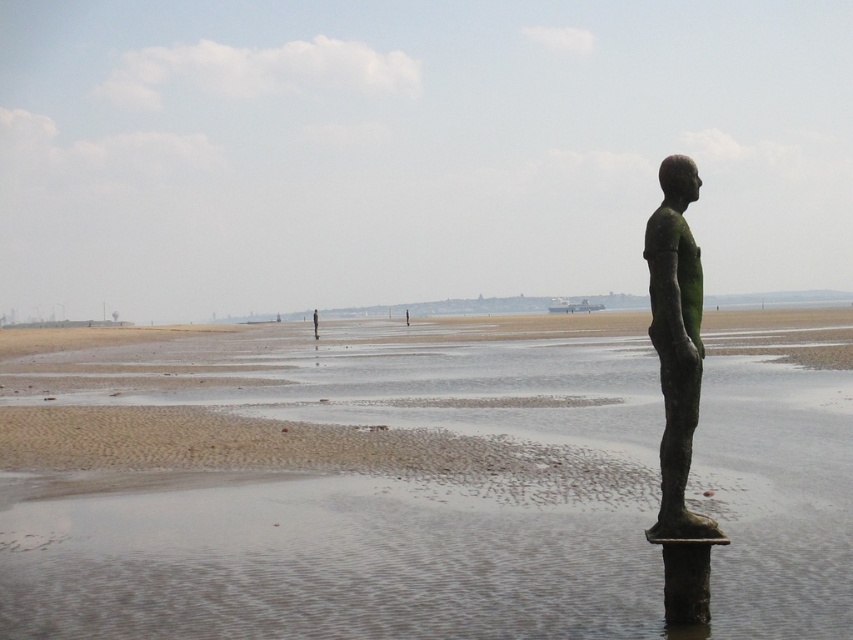
Based on the photo, which is above, sandy brown beach at center or green patina bronze statue at right?

green patina bronze statue at right is higher up.

Between sandy brown beach at center and green patina bronze statue at right, which one appears on the right side from the viewer's perspective?

Positioned to the right is green patina bronze statue at right.

The width and height of the screenshot is (853, 640). Identify the location of sandy brown beach at center. (335, 484).